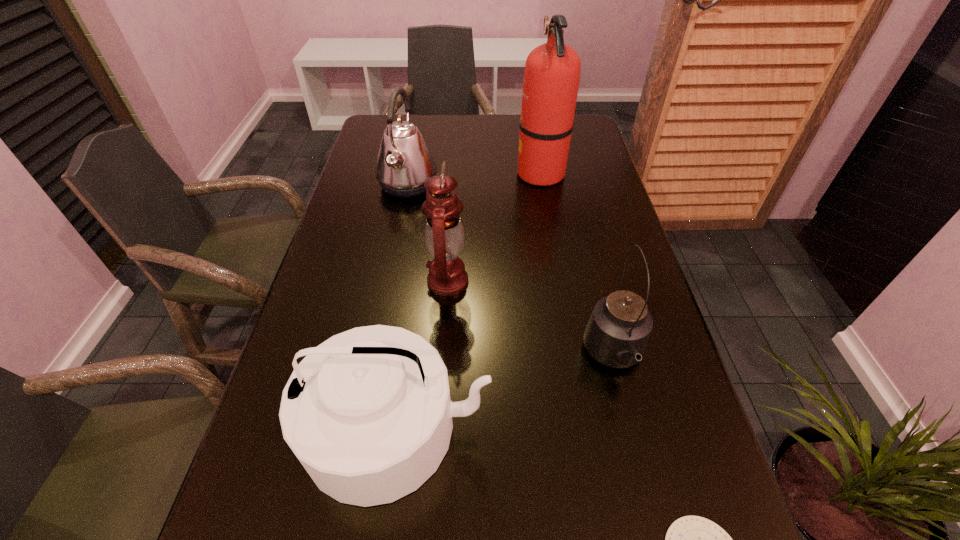
This screenshot has height=540, width=960. Identify the location of fire extinguisher that is at the right edge. (552, 71).

Where is `kettle that is at the right edge`? The image size is (960, 540). kettle that is at the right edge is located at coordinates (x=617, y=333).

In order to click on free spot at the left edge of the desktop in this screenshot , I will do point(348,186).

At what (x,y) coordinates should I click in order to perform the action: click on blank space at the right edge. Please return your answer as a coordinate pair (x, y). This screenshot has width=960, height=540. Looking at the image, I should click on (620, 240).

In the image, there is a desktop. Identify the location of free space at the far right corner. This screenshot has height=540, width=960. (582, 145).

Locate an element on the screen. The width and height of the screenshot is (960, 540). free spot between the oil lamp and the rightmost kettle is located at coordinates (531, 319).

The height and width of the screenshot is (540, 960). What are the coordinates of `object that stands as the fifth closest to the tallest object` in the screenshot? It's located at (x=690, y=539).

Identify which object is the fifth nearest to the farthest kettle. Please provide its 2D coordinates. Your answer should be formatted as a tuple, i.e. [(x, y)], where the tuple contains the x and y coordinates of a point satisfying the conditions above.

[(690, 539)]

This screenshot has width=960, height=540. In order to click on kettle identified as the third closest to the tallest object in this screenshot , I will do `click(368, 414)`.

Locate which kettle is the closest to the fire extinguisher. Please provide its 2D coordinates. Your answer should be formatted as a tuple, i.e. [(x, y)], where the tuple contains the x and y coordinates of a point satisfying the conditions above.

[(404, 162)]